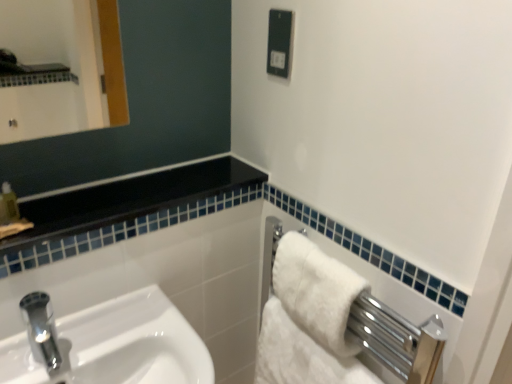
I want to click on empty space that is ontop of white fluffy bath towel at right, the second bath towel viewed from the top (from a real-world perspective), so click(x=308, y=339).